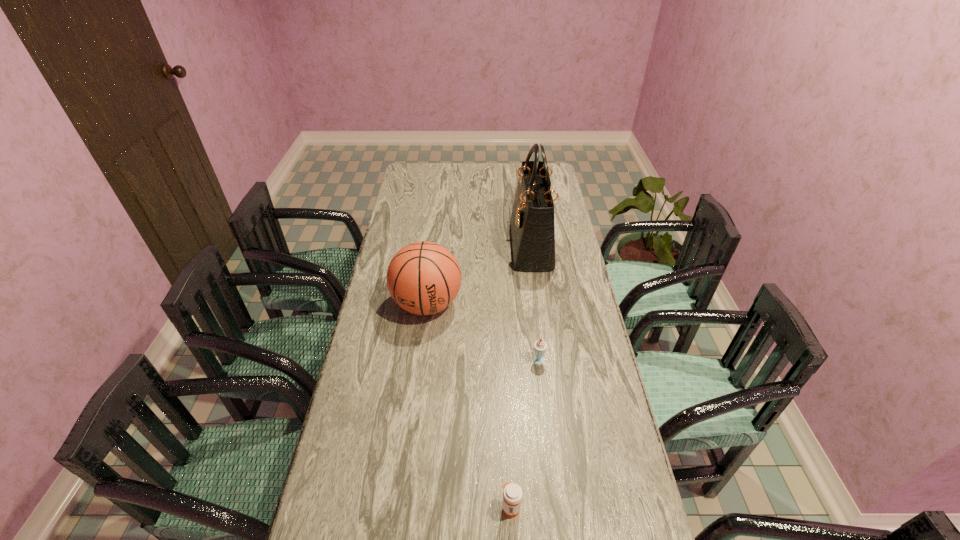
Identify the location of free space that satisfies the following two spatial constraints: 1. on the surface of the third nearest object near the brand logo; 2. on the right side of the nearest object. (402, 508).

Where is `vacant area that satisfies the following two spatial constraints: 1. at the front of the tallest object with visible charms; 2. on the straw side of the milkshake`? vacant area that satisfies the following two spatial constraints: 1. at the front of the tallest object with visible charms; 2. on the straw side of the milkshake is located at coordinates (547, 360).